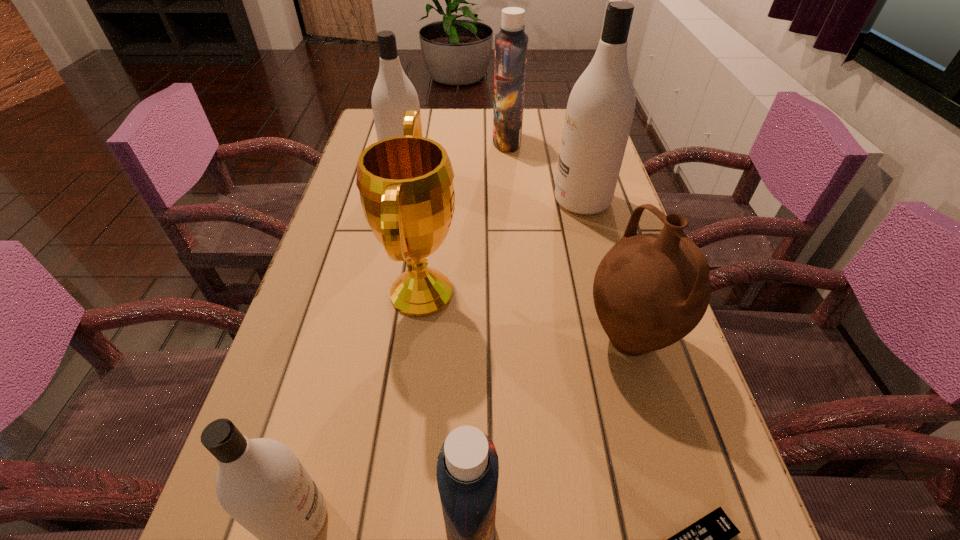
Find the location of a particular element. the tallest object is located at coordinates (600, 108).

Where is `the rightmost shampoo`? Image resolution: width=960 pixels, height=540 pixels. the rightmost shampoo is located at coordinates (600, 108).

At what (x,y) coordinates should I click in order to perform the action: click on the fourth object from right to left. Please return your answer as a coordinate pair (x, y). This screenshot has height=540, width=960. Looking at the image, I should click on click(511, 44).

Identify the location of the second shampoo from right to left. (511, 44).

Where is `the second smallest white shampoo`? the second smallest white shampoo is located at coordinates (393, 93).

Locate an element on the screen. The width and height of the screenshot is (960, 540). award is located at coordinates (406, 188).

Find the location of `pitcher`. pitcher is located at coordinates (650, 290).

This screenshot has width=960, height=540. In order to click on vacant space situated 0.190m on the front-facing side of the rightmost white shampoo in this screenshot , I will do `click(480, 201)`.

The image size is (960, 540). Identify the location of free space located 0.180m on the front-facing side of the rightmost white shampoo. (484, 201).

You are a GUI agent. You are given a task and a screenshot of the screen. Output one action in this format:
    pyautogui.click(x=<x>, y=<y>)
    Task: Click on the free region located on the front-facing side of the rightmost white shampoo
    This screenshot has height=540, width=960.
    Given the screenshot: What is the action you would take?
    pyautogui.click(x=429, y=201)